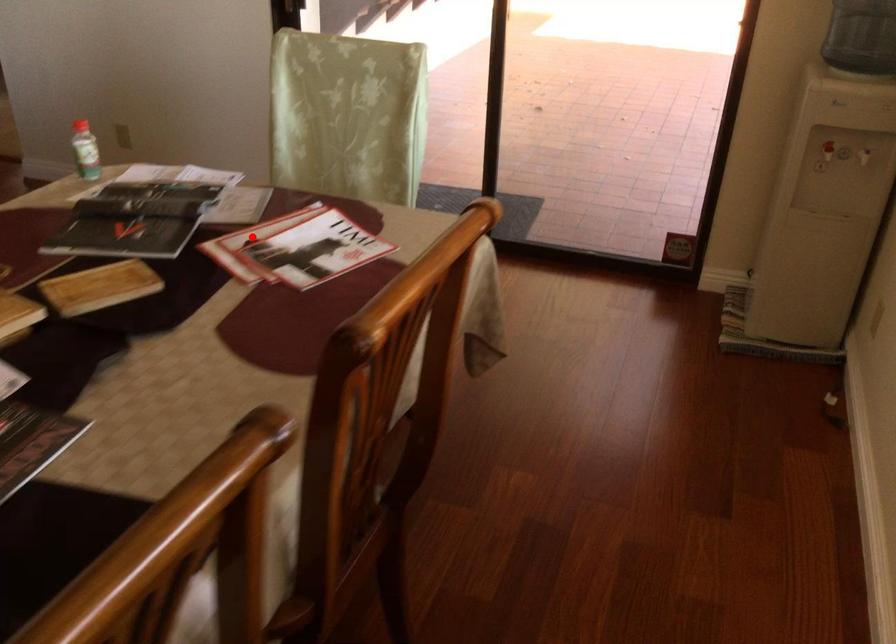
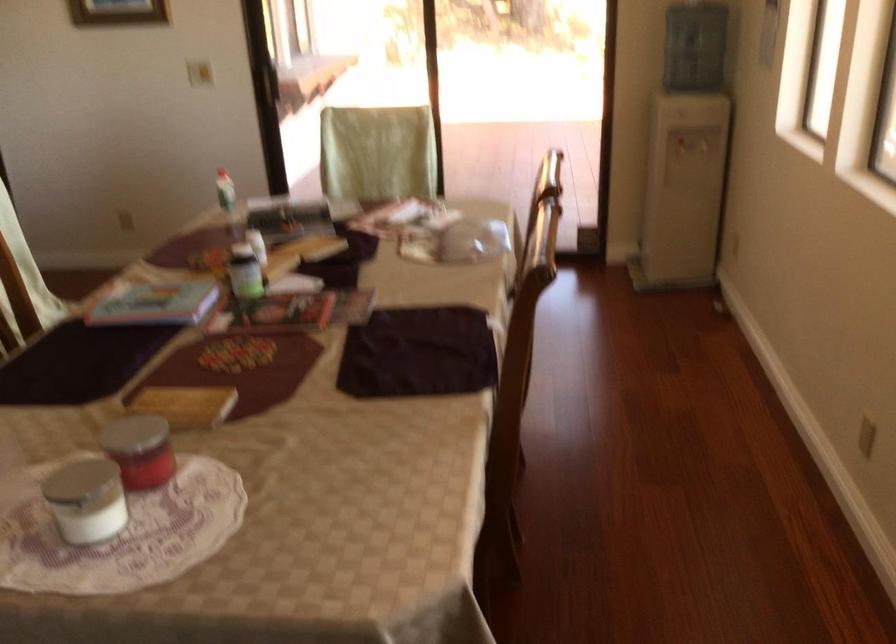
In the second image, find the point that corresponds to the highlighted location in the first image.

(366, 218)